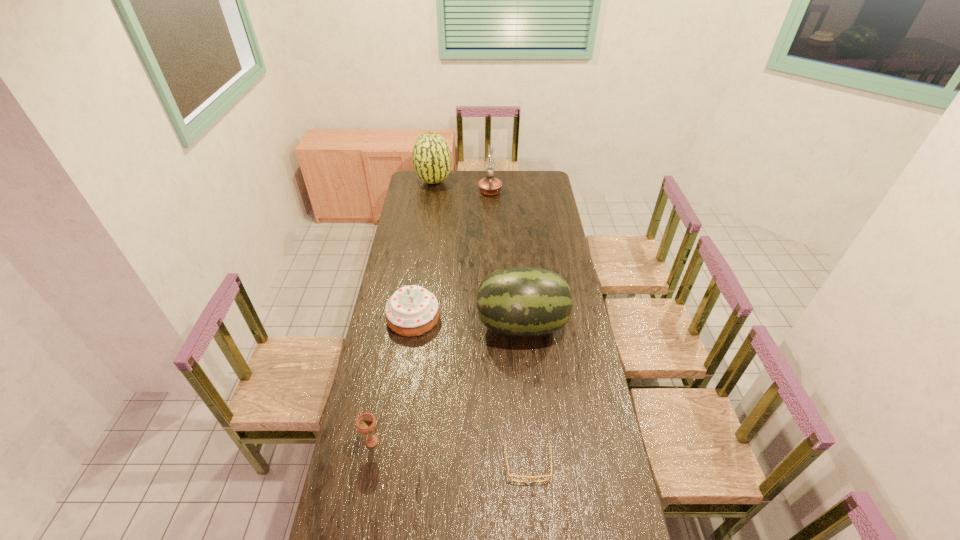
What are the coordinates of `free region located on the right of the chalice` in the screenshot? It's located at (404, 442).

You are a GUI agent. You are given a task and a screenshot of the screen. Output one action in this format:
    pyautogui.click(x=<x>, y=<y>)
    Task: Click on the vacant region located in front of the lenses of the shortest object
    The height and width of the screenshot is (540, 960).
    Given the screenshot: What is the action you would take?
    pyautogui.click(x=532, y=505)

At what (x,y) coordinates should I click in order to perform the action: click on watermelon at the far edge. Please return your answer as a coordinate pair (x, y). Looking at the image, I should click on (431, 156).

The height and width of the screenshot is (540, 960). I want to click on oil lamp at the far edge, so click(489, 186).

Where is `watermelon at the left edge`? The width and height of the screenshot is (960, 540). watermelon at the left edge is located at coordinates (431, 156).

At what (x,y) coordinates should I click in order to perform the action: click on cake located in the left edge section of the desktop. Please return your answer as a coordinate pair (x, y). Looking at the image, I should click on click(412, 310).

This screenshot has width=960, height=540. I want to click on chalice that is at the left edge, so click(x=366, y=423).

The width and height of the screenshot is (960, 540). Identify the location of object that is at the right edge. (524, 302).

Locate an element on the screen. object present at the far left corner is located at coordinates (431, 156).

In the image, there is a desktop. Identify the location of free region at the far edge. (494, 172).